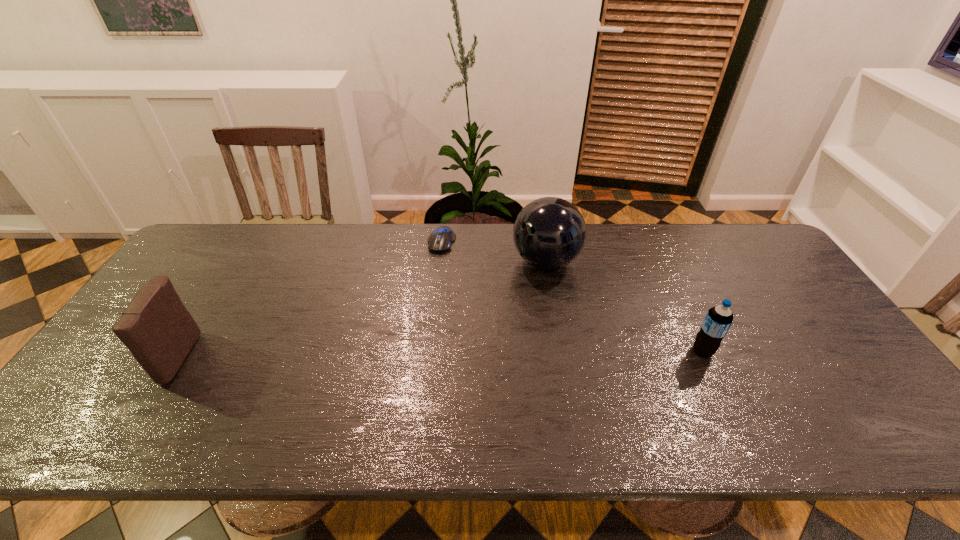
Identify the location of vacant space on the desktop that is between the pouch and the soda bottle and is positioned on the button side of the computer mouse. (395, 355).

Identify the location of free spot on the desktop that is between the pouch and the rightmost object and is positioned on the side of the bowling ball with the finger holes. (425, 355).